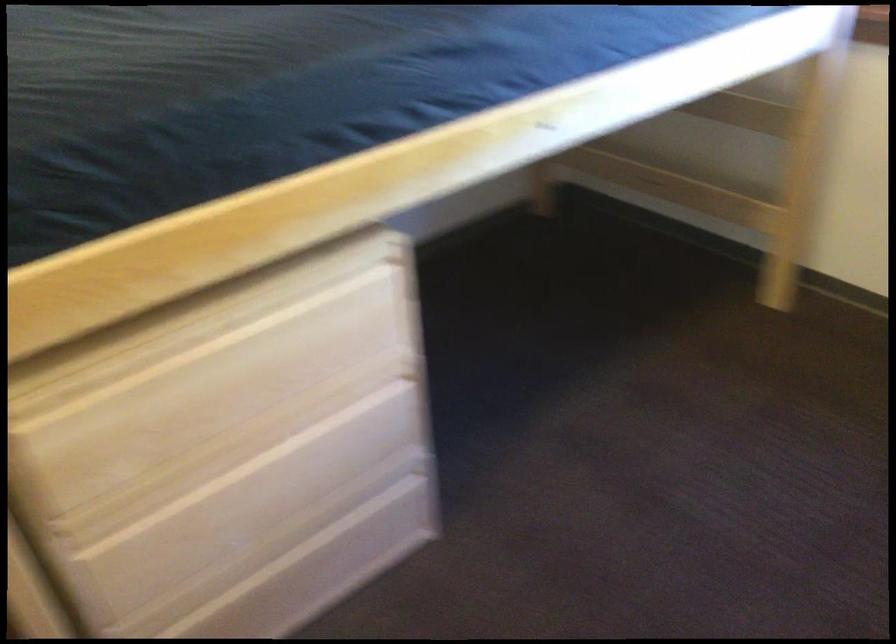
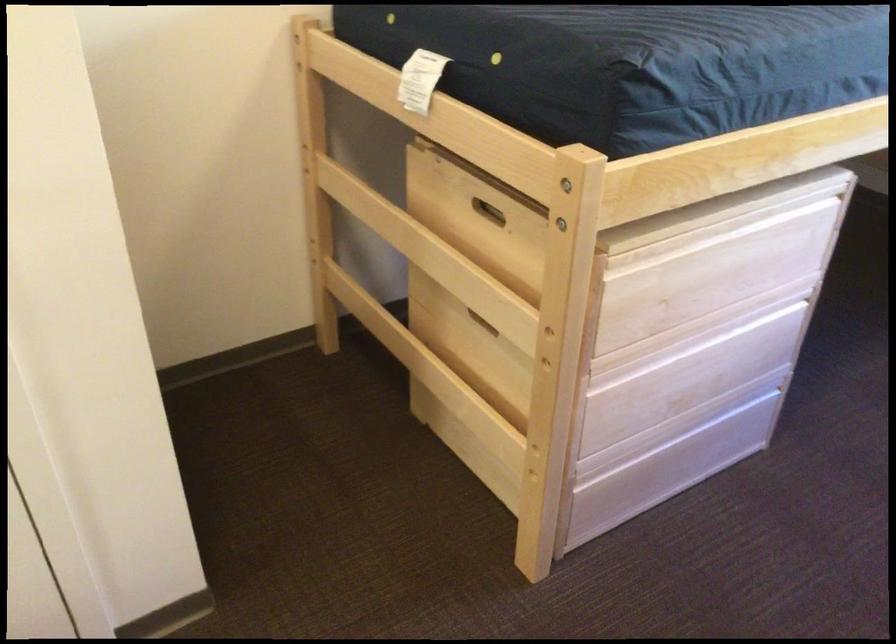
Where in the second image is the point corresponding to [286,444] from the first image?

(718, 342)